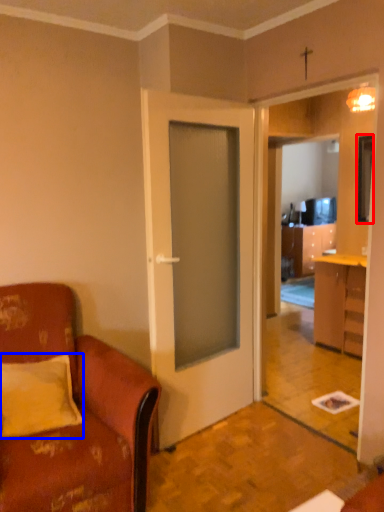
Question: Among these objects, which one is farthest to the camera, television (highlighted by a red box) or pillow (highlighted by a blue box)?

Choices:
 (A) television
 (B) pillow

Answer: (A)